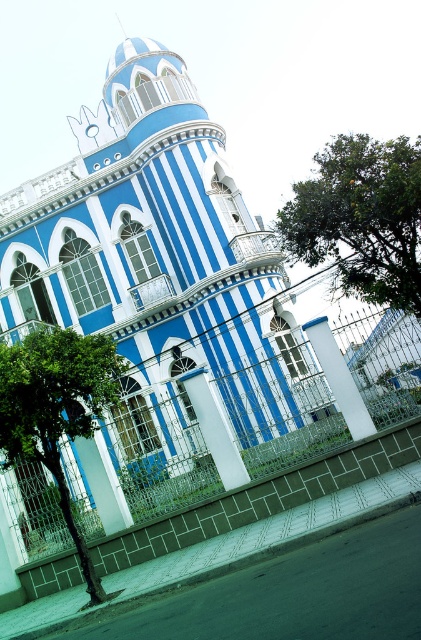
Who is shorter, green leafy tree at upper right or green leafy tree at lower left?

With less height is green leafy tree at lower left.

Is green leafy tree at upper right further to camera compared to green leafy tree at lower left?

That is True.

Does point (407, 221) come in front of point (39, 406)?

No, it is behind (39, 406).

The width and height of the screenshot is (421, 640). Identify the location of green leafy tree at upper right. (362, 218).

Can you confirm if metallic wire fence at center is positioned to the left of green leafy tree at lower left?

In fact, metallic wire fence at center is to the right of green leafy tree at lower left.

Is point (197, 476) closer to camera compared to point (47, 324)?

Yes.

Which is in front, point (24, 522) or point (82, 376)?

Point (82, 376) is in front.

Identify the location of metallic wire fence at center. The width and height of the screenshot is (421, 640). (280, 413).

Does blue glossy building at center appear under metallic wire fence at center?

No, blue glossy building at center is not below metallic wire fence at center.

From the picture: Can you confirm if blue glossy building at center is positioned to the right of metallic wire fence at center?

In fact, blue glossy building at center is to the left of metallic wire fence at center.

Between point (125, 356) and point (276, 433), which one is positioned in front?

Positioned in front is point (276, 433).

At what (x,y) coordinates should I click in order to perform the action: click on blue glossy building at center. Please return your answer as a coordinate pair (x, y). Image resolution: width=421 pixels, height=640 pixels. Looking at the image, I should click on (160, 292).